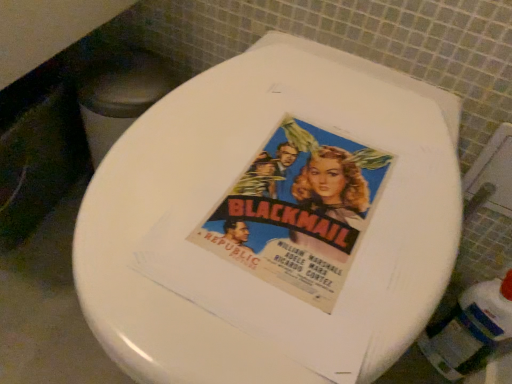
Question: Does white plastic bottle at lower right lie behind white glossy toilet seat at center?

Choices:
 (A) yes
 (B) no

Answer: (A)

Question: Is white plastic bottle at lower right taller than white glossy toilet seat at center?

Choices:
 (A) yes
 (B) no

Answer: (B)

Question: Is white plastic bottle at lower right positioned with its back to white glossy toilet seat at center?

Choices:
 (A) no
 (B) yes

Answer: (A)

Question: Is white plastic bottle at lower right closer to camera compared to white glossy toilet seat at center?

Choices:
 (A) no
 (B) yes

Answer: (A)

Question: Is the surface of white plastic bottle at lower right in direct contact with white glossy toilet seat at center?

Choices:
 (A) no
 (B) yes

Answer: (A)

Question: Does white plastic bottle at lower right have a smaller size compared to white glossy toilet seat at center?

Choices:
 (A) yes
 (B) no

Answer: (A)

Question: Can you confirm if white glossy toilet seat at center is taller than white plastic bottle at lower right?

Choices:
 (A) yes
 (B) no

Answer: (A)

Question: Is white glossy toilet seat at center smaller than white plastic bottle at lower right?

Choices:
 (A) no
 (B) yes

Answer: (A)

Question: Is the depth of white glossy toilet seat at center greater than that of white plastic bottle at lower right?

Choices:
 (A) yes
 (B) no

Answer: (B)

Question: From a real-world perspective, is white glossy toilet seat at center located beneath white plastic bottle at lower right?

Choices:
 (A) no
 (B) yes

Answer: (A)

Question: Is white glossy toilet seat at center outside of white plastic bottle at lower right?

Choices:
 (A) yes
 (B) no

Answer: (A)

Question: Is white glossy toilet seat at center to the right of white plastic bottle at lower right from the viewer's perspective?

Choices:
 (A) yes
 (B) no

Answer: (B)

Question: Is white glossy toilet seat at center bigger or smaller than white plastic bottle at lower right?

Choices:
 (A) small
 (B) big

Answer: (B)